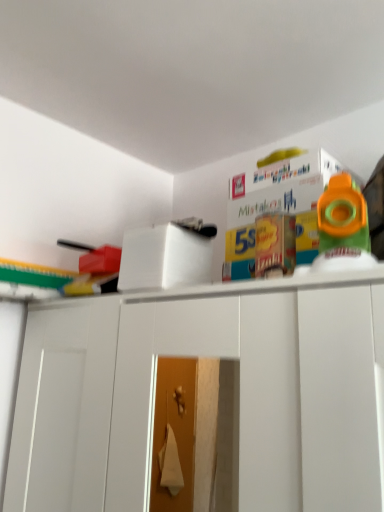
This screenshot has width=384, height=512. Describe the element at coordinates (166, 256) in the screenshot. I see `white matte box at center` at that location.

The height and width of the screenshot is (512, 384). I want to click on white matte box at center, so click(166, 256).

What is the approximate height of white matte box at center?

white matte box at center is 4.82 inches in height.

Locate an element on the screen. white matte box at center is located at coordinates (166, 256).